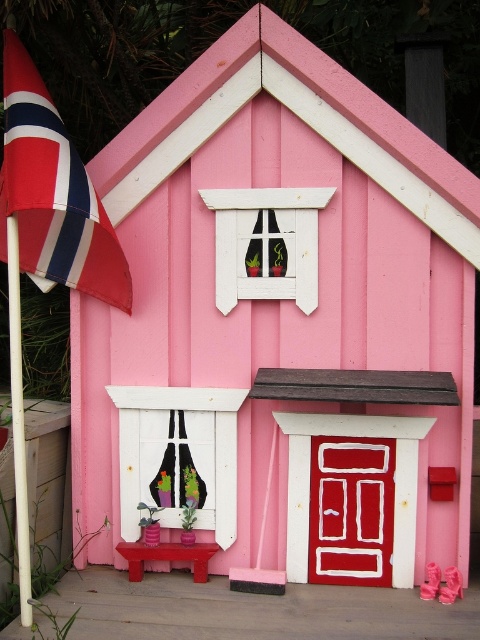
You are standing in front of the pink house and notice the red and white striped flag at left and the matte pink shoes at lower right. Which object is positioned higher from the ground?

The red and white striped flag at left is above matte pink shoes at lower right, so the flag is higher up.

In the scene shown: You are standing in front of the pink house and want to place your new pink matte flower pot at lower center near the entrance. However, there are already matte pink shoes at lower right. Where should you place the flower pot to avoid stepping on the shoes?

The pink matte flower pot at lower center should be placed above the matte pink shoes at lower right since the shoes are located below the flower pot.

You are standing in front of the miniature pink house and see the point at coordinates point (451, 586). What object is located at that point?

The point (451, 586) marks matte pink shoes at lower right.